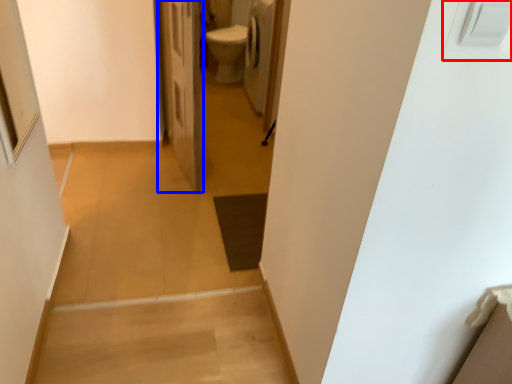
Question: Which object is further to the camera taking this photo, electric outlet (highlighted by a red box) or door (highlighted by a blue box)?

Choices:
 (A) electric outlet
 (B) door

Answer: (B)